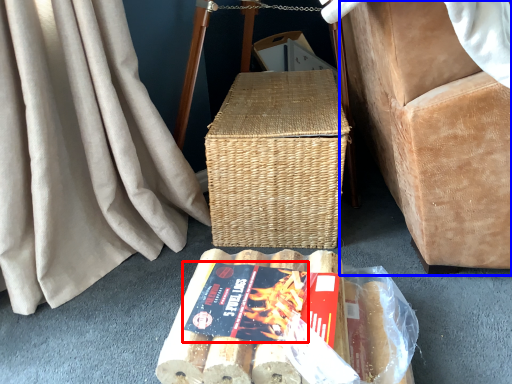
Question: Which object appears closest to the camera in this image, paperback book (highlighted by a red box) or furniture (highlighted by a blue box)?

Choices:
 (A) paperback book
 (B) furniture

Answer: (B)